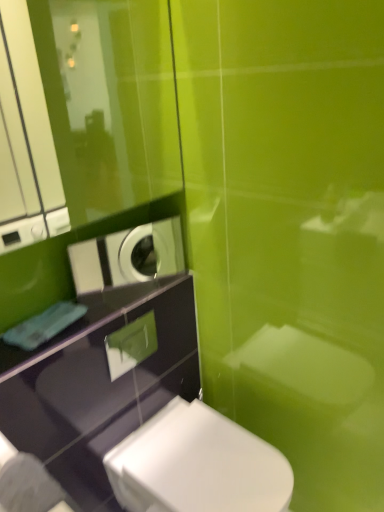
Question: From the image's perspective, is white glossy toilet at lower center positioned above or below white glossy washing machine at upper left?

Choices:
 (A) below
 (B) above

Answer: (A)

Question: In terms of width, does white glossy toilet at lower center look wider or thinner when compared to white glossy washing machine at upper left?

Choices:
 (A) thin
 (B) wide

Answer: (B)

Question: From a real-world perspective, relative to white glossy washing machine at upper left, is white glossy toilet at lower center vertically above or below?

Choices:
 (A) above
 (B) below

Answer: (B)

Question: From their relative heights in the image, would you say white glossy washing machine at upper left is taller or shorter than white glossy toilet at lower center?

Choices:
 (A) short
 (B) tall

Answer: (A)

Question: Is point (158, 253) positioned closer to the camera than point (264, 475)?

Choices:
 (A) closer
 (B) farther

Answer: (B)

Question: From the image's perspective, is white glossy washing machine at upper left above or below white glossy toilet at lower center?

Choices:
 (A) below
 (B) above

Answer: (B)

Question: Considering their positions, is white glossy washing machine at upper left located in front of or behind white glossy toilet at lower center?

Choices:
 (A) front
 (B) behind

Answer: (B)